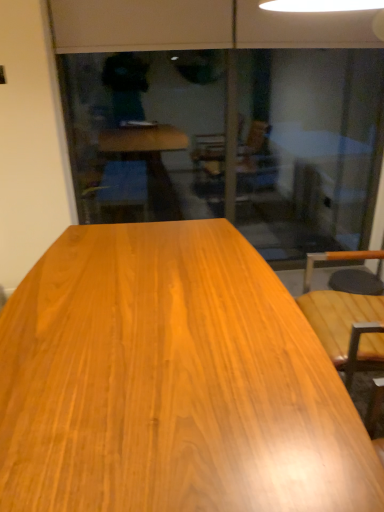
Question: Is glossy wood table at center behind transparent glass screen door at center?

Choices:
 (A) no
 (B) yes

Answer: (A)

Question: Is glossy wood table at center surrounding transparent glass screen door at center?

Choices:
 (A) yes
 (B) no

Answer: (B)

Question: Is glossy wood table at center oriented away from transparent glass screen door at center?

Choices:
 (A) yes
 (B) no

Answer: (B)

Question: From the image's perspective, is glossy wood table at center located beneath transparent glass screen door at center?

Choices:
 (A) yes
 (B) no

Answer: (A)

Question: Is glossy wood table at center bigger than transparent glass screen door at center?

Choices:
 (A) yes
 (B) no

Answer: (A)

Question: Is glossy wood table at center beside transparent glass screen door at center?

Choices:
 (A) yes
 (B) no

Answer: (B)

Question: Does transparent glass screen door at center have a lesser height compared to glossy wood table at center?

Choices:
 (A) yes
 (B) no

Answer: (B)

Question: Are transparent glass screen door at center and glossy wood table at center making contact?

Choices:
 (A) no
 (B) yes

Answer: (A)

Question: Considering the relative sizes of transparent glass screen door at center and glossy wood table at center in the image provided, is transparent glass screen door at center wider than glossy wood table at center?

Choices:
 (A) no
 (B) yes

Answer: (A)

Question: From a real-world perspective, is transparent glass screen door at center below glossy wood table at center?

Choices:
 (A) yes
 (B) no

Answer: (B)

Question: Is transparent glass screen door at center further to the viewer compared to glossy wood table at center?

Choices:
 (A) yes
 (B) no

Answer: (A)

Question: Is transparent glass screen door at center not within glossy wood table at center?

Choices:
 (A) yes
 (B) no

Answer: (A)

Question: Considering their positions, is transparent glass screen door at center located in front of or behind glossy wood table at center?

Choices:
 (A) front
 (B) behind

Answer: (B)